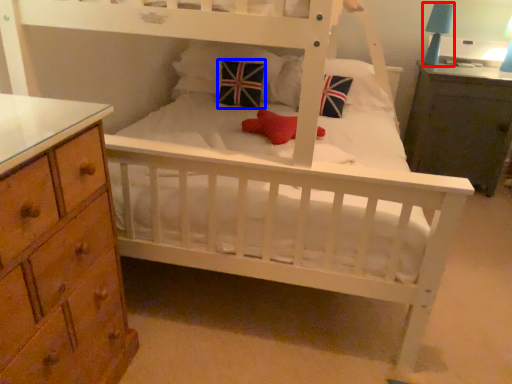
Question: Among these objects, which one is farthest to the camera, table lamp (highlighted by a red box) or throw pillow (highlighted by a blue box)?

Choices:
 (A) table lamp
 (B) throw pillow

Answer: (A)